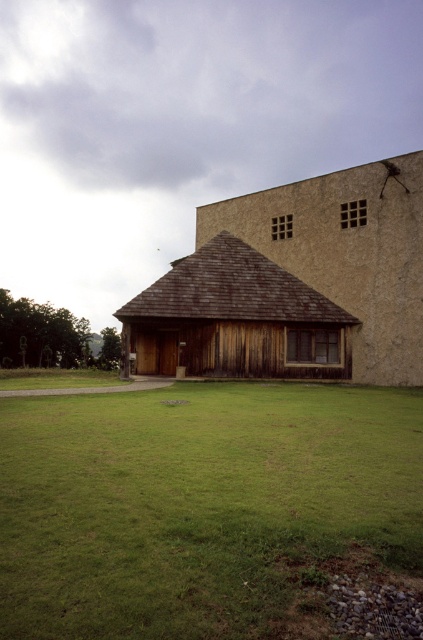
You are standing in the modern architectural structure and want to walk to the weathered wood hut at center. Which direction should you walk to reach it from the green grass at center?

The green grass at center is positioned on the left side of weathered wood hut at center, so you should walk to the right to reach the weathered wood hut at center from the green grass at center.